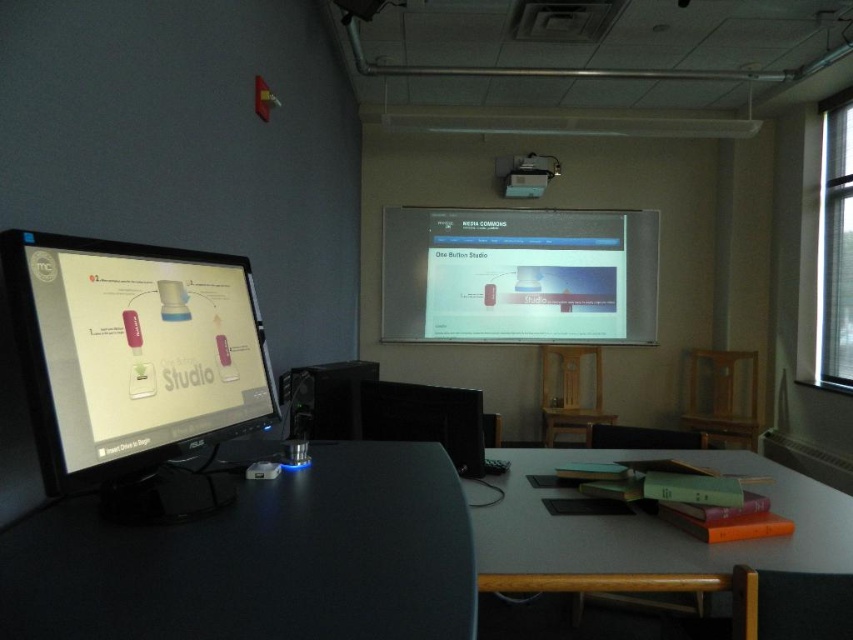
Is the position of black matte computer desk at lower left more distant than that of smooth gray table at lower right?

No.

Is black matte computer desk at lower left shorter than smooth gray table at lower right?

Correct, black matte computer desk at lower left is not as tall as smooth gray table at lower right.

At what (x,y) coordinates should I click in order to perform the action: click on black matte computer desk at lower left. Please return your answer as a coordinate pair (x, y). Looking at the image, I should click on click(x=259, y=560).

The height and width of the screenshot is (640, 853). Identify the location of black matte computer desk at lower left. [x=259, y=560].

Is black matte computer desk at lower left positioned in front of white glossy projection screen at upper center?

Yes.

Who is more forward, (154,592) or (453,243)?

Point (154,592) is in front.

Which is in front, point (405, 620) or point (424, 250)?

Point (405, 620) is more forward.

Where is `black matte computer desk at lower left`? black matte computer desk at lower left is located at coordinates (259, 560).

Between white glossy projection screen at upper center and smooth gray table at lower right, which one appears on the left side from the viewer's perspective?

smooth gray table at lower right is more to the left.

Measure the distance between point (410, 285) and camera.

The distance of point (410, 285) from camera is 5.76 meters.

Describe the element at coordinates (519, 275) in the screenshot. I see `white glossy projection screen at upper center` at that location.

Where is `white glossy projection screen at upper center`? white glossy projection screen at upper center is located at coordinates coord(519,275).